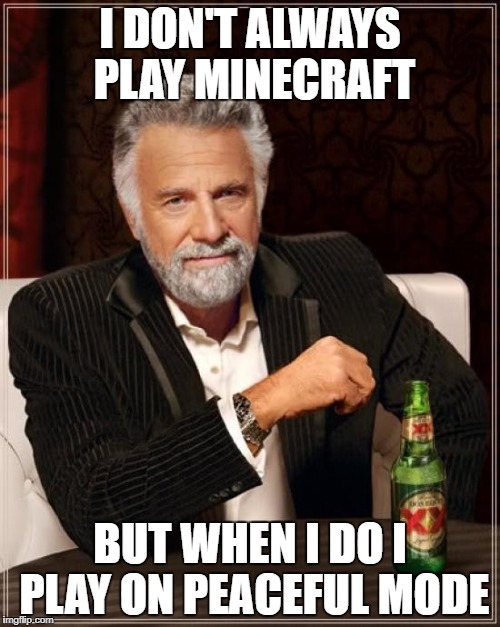
You are a GUI agent. You are given a task and a screenshot of the screen. Output one action in this format:
    pyautogui.click(x=<x>, y=<y>)
    Task: Click on the bottle
    
    Given the screenshot: What is the action you would take?
    pyautogui.click(x=418, y=472)